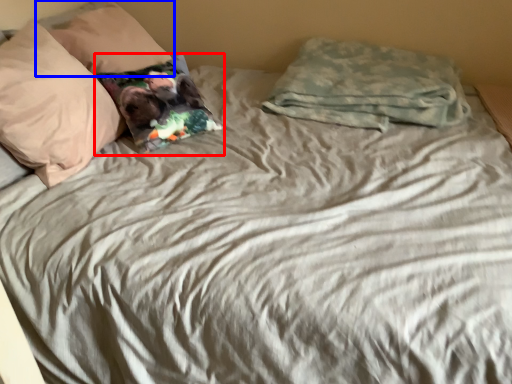
Question: Which object appears closest to the camera in this image, pillow (highlighted by a red box) or pillow (highlighted by a blue box)?

Choices:
 (A) pillow
 (B) pillow

Answer: (A)